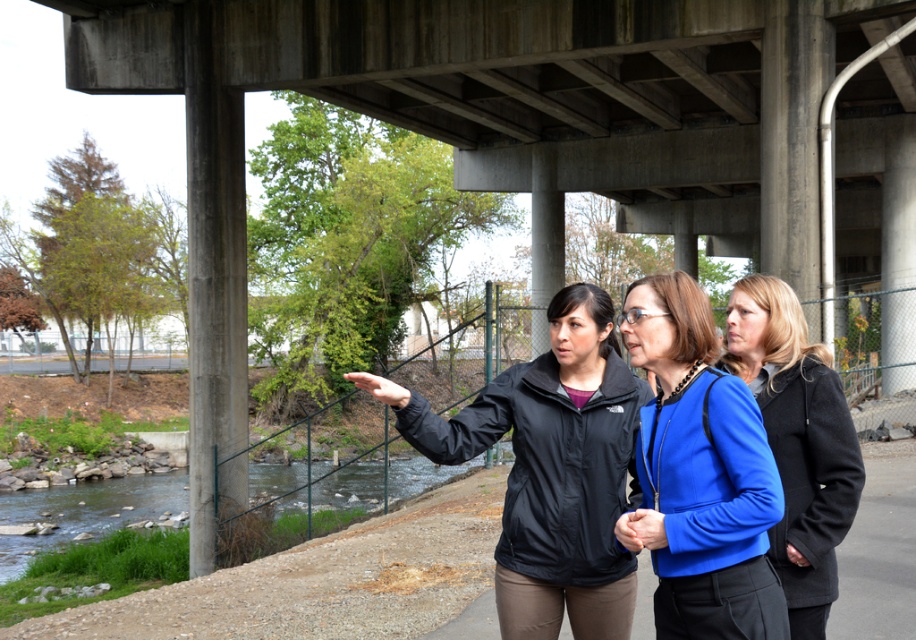
Where is `black matte jacket at center`? black matte jacket at center is located at coordinates (551, 468).

What do you see at coordinates (551, 468) in the screenshot? This screenshot has width=916, height=640. I see `black matte jacket at center` at bounding box center [551, 468].

Where is `black matte jacket at center`? This screenshot has width=916, height=640. black matte jacket at center is located at coordinates (551, 468).

How distant is blue matte jacket at center from clear water at lower left?

blue matte jacket at center and clear water at lower left are 50.13 feet apart.

Which is in front, point (738, 433) or point (412, 474)?

Point (738, 433) is more forward.

The width and height of the screenshot is (916, 640). In order to click on blue matte jacket at center in this screenshot , I will do `click(699, 476)`.

In the scene shown: Who is more forward, (505,536) or (751,516)?

Point (751,516) is in front.

Which is more to the right, black matte jacket at center or blue matte jacket at center?

Positioned to the right is blue matte jacket at center.

Locate an element on the screen. The image size is (916, 640). black matte jacket at center is located at coordinates (551, 468).